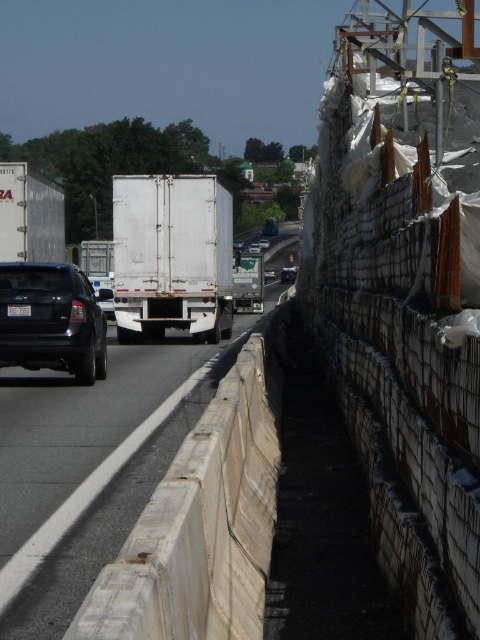
Question: Among these points, which one is farthest from the camera?

Choices:
 (A) (36, 284)
 (B) (173, 305)
 (C) (292, 280)
 (D) (76, 544)

Answer: (C)

Question: Can you confirm if white matte truck at center is positioned below white matte trailer truck at center?

Choices:
 (A) yes
 (B) no

Answer: (A)

Question: Can you confirm if white matte truck at center is positioned above white glossy truck at center?

Choices:
 (A) no
 (B) yes

Answer: (A)

Question: Which object is positioned closest to the satin black sedan at left?

Choices:
 (A) white matte truck at center
 (B) white matte trailer truck at center
 (C) white glossy truck at center
 (D) shiny black sedan at center

Answer: (A)

Question: Estimate the real-world distances between objects in this image. Which object is closer to the white matte trailer truck at center?

Choices:
 (A) white matte truck at center
 (B) white glossy truck at center
 (C) satin black sedan at left
 (D) shiny black sedan at center

Answer: (A)

Question: Is white matte trailer truck at center above shiny black sedan at center?

Choices:
 (A) yes
 (B) no

Answer: (B)